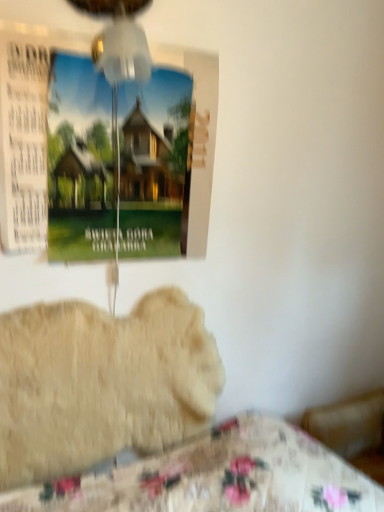
Question: Would you say fluffy beige dog at lower left is to the left or to the right of transparent plastic mechanical fan at upper center in the picture?

Choices:
 (A) left
 (B) right

Answer: (A)

Question: Is fluffy beige dog at lower left taller or shorter than transparent plastic mechanical fan at upper center?

Choices:
 (A) tall
 (B) short

Answer: (A)

Question: Estimate the real-world distances between objects in this image. Which object is closer to the transparent plastic mechanical fan at upper center?

Choices:
 (A) fluffy beige dog at lower left
 (B) matte paper poster at upper left

Answer: (B)

Question: Based on their relative distances, which object is nearer to the matte paper poster at upper left?

Choices:
 (A) transparent plastic mechanical fan at upper center
 (B) fluffy beige dog at lower left

Answer: (A)